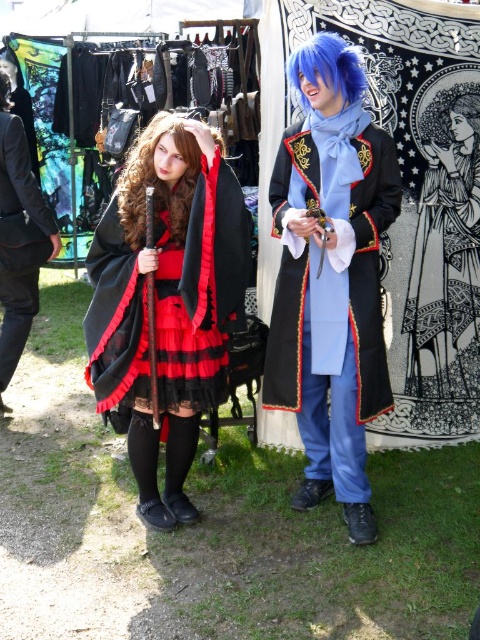
You are a photographer at a cosplay event. You need to position the blue synthetic wig at upper center and the blonde silk hair at upper right in your shot. Which one should you focus on if you want to capture the larger object in the frame?

You should focus on the blue synthetic wig at upper center because it is larger than the blonde silk hair at upper right.

You are a photographer at a cosplay event. You need to capture a closeup shot of the blue synthetic wig at upper center and the blonde silk hair at upper right. Which of the two has a smaller width when viewed from the front?

The blue synthetic wig at upper center is thinner than the blonde silk hair at upper right, so the blue synthetic wig at upper center has a smaller width when viewed from the front.